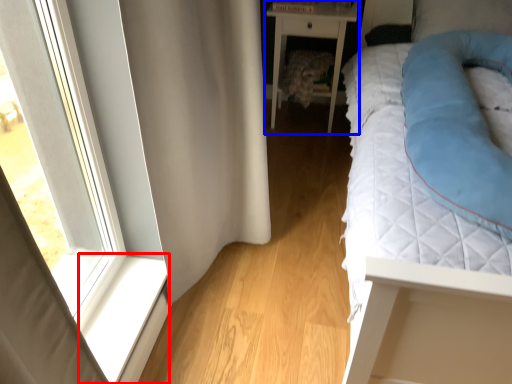
Question: Among these objects, which one is farthest to the camera, window sill (highlighted by a red box) or nightstand (highlighted by a blue box)?

Choices:
 (A) window sill
 (B) nightstand

Answer: (B)